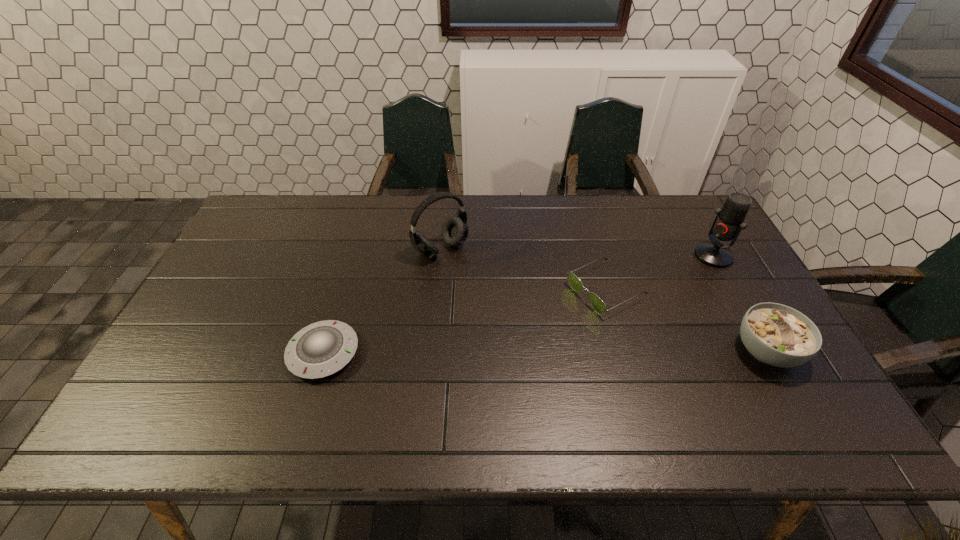
At what (x,y) coordinates should I click in order to perform the action: click on saucer. Please return your answer as a coordinate pair (x, y). The width and height of the screenshot is (960, 540). Looking at the image, I should click on pos(320,349).

Locate an element on the screen. Image resolution: width=960 pixels, height=540 pixels. the leftmost object is located at coordinates (320, 349).

Identify the location of the third tallest object. (778, 335).

The image size is (960, 540). I want to click on the third object from right to left, so click(x=598, y=305).

What are the coordinates of `microphone` in the screenshot? It's located at (729, 222).

Locate an element on the screen. The height and width of the screenshot is (540, 960). headset is located at coordinates (455, 229).

Identify the location of free location located on the left of the shortest object. (233, 353).

You are a GUI agent. You are given a task and a screenshot of the screen. Output one action in this format:
    pyautogui.click(x=<x>, y=<y>)
    Task: Click on the vacant space located on the left of the soup bowl
    This screenshot has width=960, height=540.
    Given the screenshot: What is the action you would take?
    pyautogui.click(x=616, y=351)

Identify the location of vacant space positioned on the front-facing side of the third object from right to left. The width and height of the screenshot is (960, 540). (514, 335).

This screenshot has width=960, height=540. Identify the location of vacant space located on the front-facing side of the third object from right to left. (504, 340).